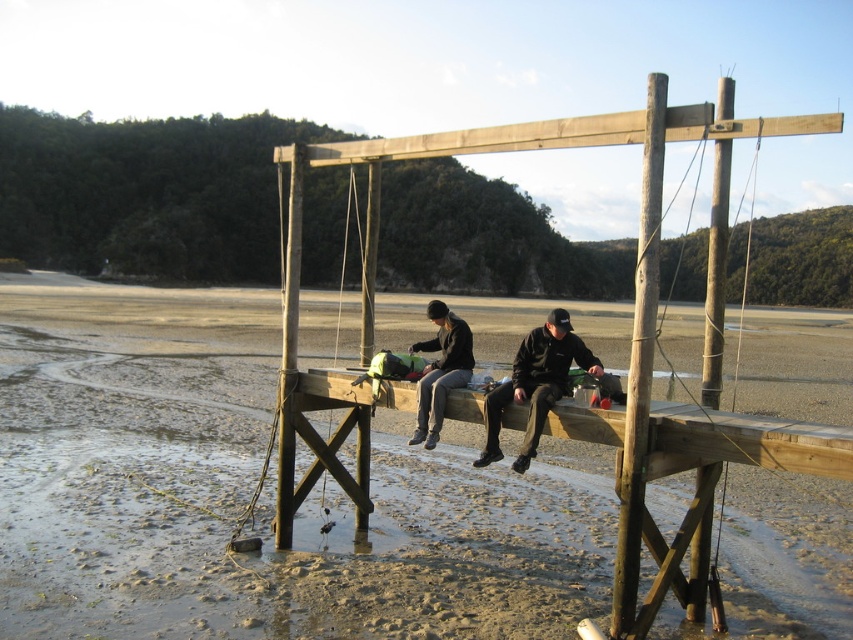
You are a photographer trying to capture a clear shot of both the black matte jacket at center and the dark gray knit hat at center. Since you want to ensure both are visible in the frame, which object should you focus on first to account for their sizes?

The black matte jacket at center is much taller than the dark gray knit hat at center, so you should focus on the black matte jacket at center first to ensure its full height is captured before adjusting the frame for the smaller dark gray knit hat at center.

You are standing on the wooden platform and want to move from one point to another. If you start at point (485, 611) and walk towards point (532, 417), will you be moving closer to the camera or further away?

Moving from point (485, 611) to point (532, 417) means you are moving closer to the camera because point (485, 611) is further away from the camera than point (532, 417).